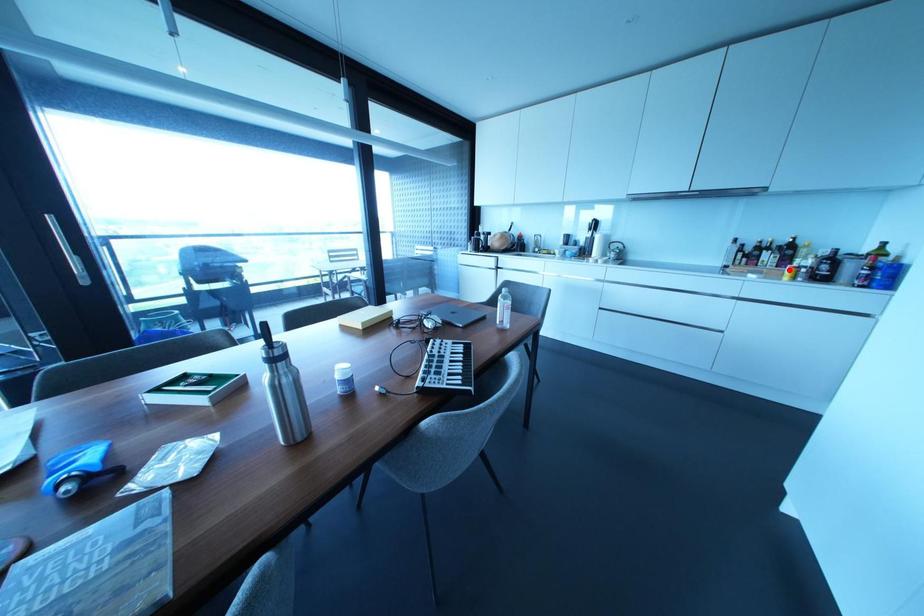
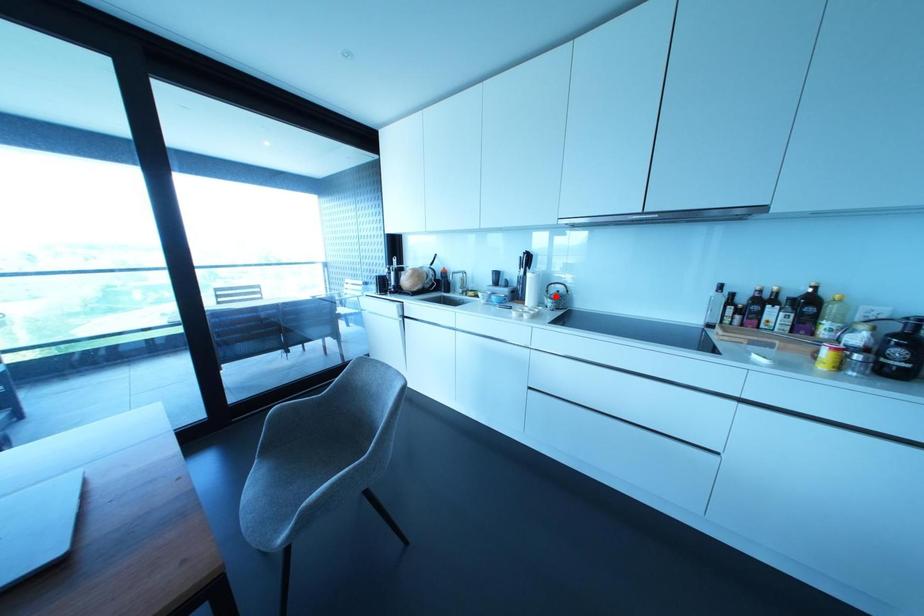
I am providing you with two images of the same scene from different viewpoints. A red point is marked on the first image and another point is marked on the second image. Does the point marked in image1 correspond to the same location as the one in image2?

No